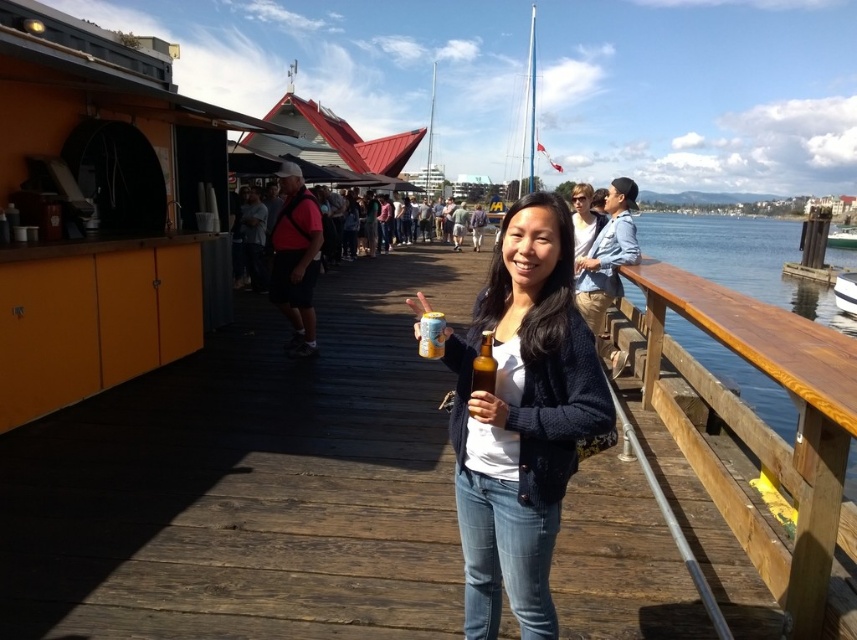
You are standing on the wooden pier and want to take a photo of the waterfront view. The wooden rail at right is in your way. Can you move to the left to avoid it?

The wooden rail at right is positioned at point (764,433), so moving to the left might help avoid it depending on your current position.

You are at a pier event and want to choose a drink to hold in one hand while taking a photo. Considering the height of the brown glass bottle at center and the yellow matte can at center, which one would require less space vertically in your hand?

The yellow matte can at center requires less vertical space because it is shorter than the brown glass bottle at center.